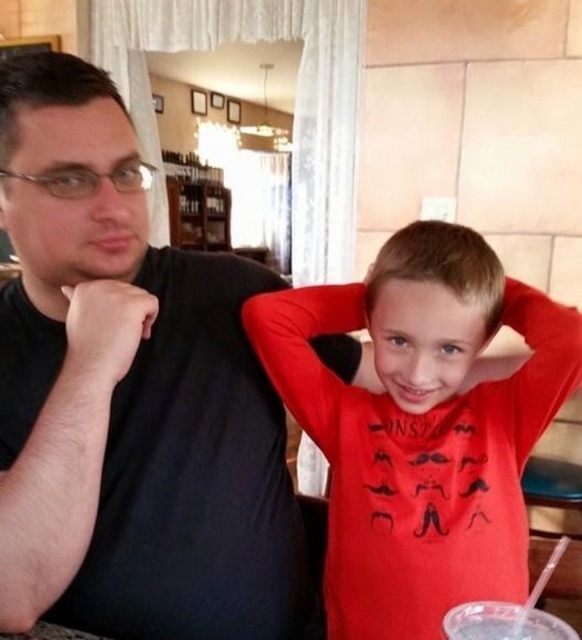
Can you confirm if black matte shirt at left is taller than clear plastic cup at lower right?

Indeed, black matte shirt at left has a greater height compared to clear plastic cup at lower right.

How far apart are black matte shirt at left and clear plastic cup at lower right?

black matte shirt at left and clear plastic cup at lower right are 17.04 inches apart.

Is point (76, 346) farther from viewer compared to point (464, 636)?

Yes, point (76, 346) is farther from viewer.

Locate an element on the screen. black matte shirt at left is located at coordinates (129, 397).

Is black matte shirt at left to the right of red matte shirt at right from the viewer's perspective?

In fact, black matte shirt at left is to the left of red matte shirt at right.

Describe the element at coordinates (129, 397) in the screenshot. I see `black matte shirt at left` at that location.

Where is `black matte shirt at left`? black matte shirt at left is located at coordinates (129, 397).

Which is in front, point (327, 392) or point (544, 612)?

Point (544, 612) is in front.

Does red matte shirt at right have a greater height compared to clear plastic cup at lower right?

Yes, red matte shirt at right is taller than clear plastic cup at lower right.

Measure the distance between point (x=324, y=296) and camera.

Point (x=324, y=296) and camera are 91.91 centimeters apart.

This screenshot has width=582, height=640. Identify the location of red matte shirt at right. (420, 426).